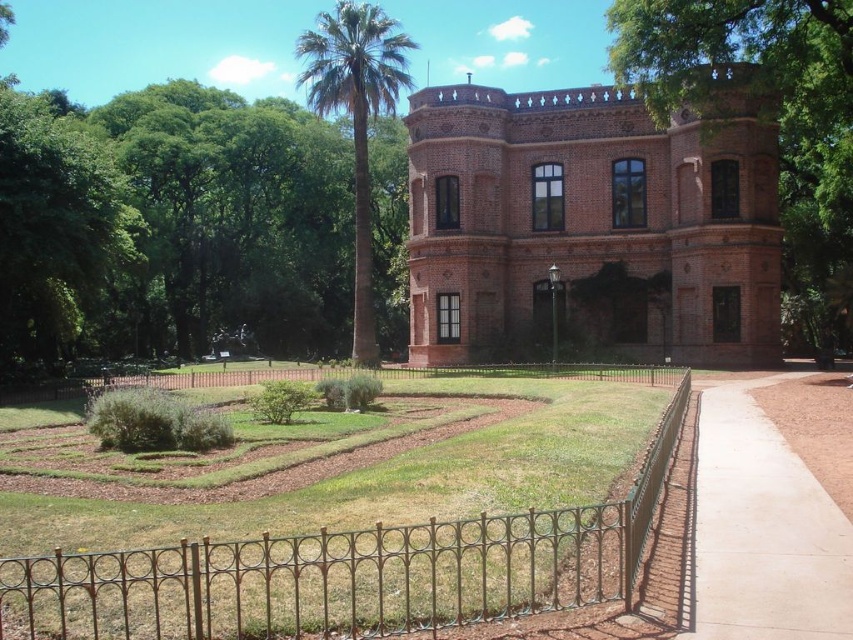
Is green wrought iron fence at center smaller than green leafy palm at center?

Indeed, green wrought iron fence at center has a smaller size compared to green leafy palm at center.

Does green wrought iron fence at center come in front of green leafy palm at center?

Yes.

Find the location of a particular element. Image resolution: width=853 pixels, height=640 pixels. green wrought iron fence at center is located at coordinates (346, 572).

Find the location of a particular element. The height and width of the screenshot is (640, 853). green wrought iron fence at center is located at coordinates (346, 572).

Consider the image. Who is more forward, (656,49) or (345,108)?

Point (656,49)

Is green leafy tree at upper center thinner than green leafy palm at center?

Incorrect, green leafy tree at upper center's width is not less than green leafy palm at center's.

This screenshot has width=853, height=640. What are the coordinates of `green leafy tree at upper center` in the screenshot? It's located at (766, 113).

This screenshot has height=640, width=853. Identify the location of green leafy tree at upper center. (766, 113).

Does green wrought iron fence at center appear on the right side of green leafy tree at upper center?

In fact, green wrought iron fence at center is to the left of green leafy tree at upper center.

Is green wrought iron fence at center shorter than green leafy tree at upper center?

Yes, green wrought iron fence at center is shorter than green leafy tree at upper center.

Who is more forward, (28, 624) or (711, 88)?

Point (28, 624)

Locate an element on the screen. This screenshot has height=640, width=853. green wrought iron fence at center is located at coordinates (346, 572).